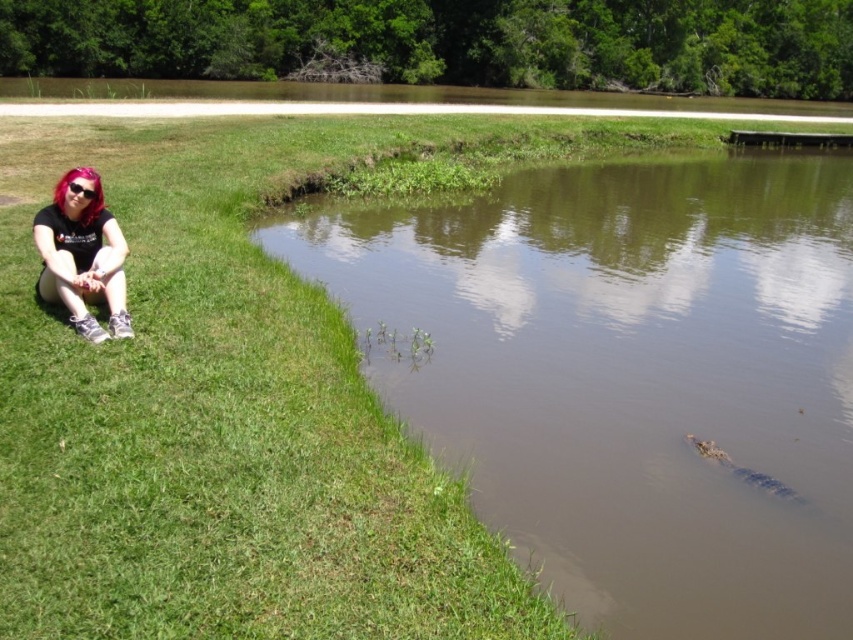
Who is lower down, brown muddy water at lower left or sunglasses at left?

brown muddy water at lower left is below.

Is point (750, 508) closer to viewer compared to point (91, 195)?

Yes, it is in front of point (91, 195).

Who is more forward, (660, 465) or (91, 193)?

Point (91, 193)

This screenshot has height=640, width=853. What are the coordinates of `brown muddy water at lower left` in the screenshot? It's located at (630, 376).

Who is more forward, (850,440) or (67,268)?

Point (67,268)

Where is `brown muddy water at lower left`? This screenshot has height=640, width=853. brown muddy water at lower left is located at coordinates [x=630, y=376].

Who is higher up, matte black hair at lower left or sunglasses at left?

sunglasses at left is higher up.

Who is more distant from viewer, (99, 276) or (73, 192)?

Positioned behind is point (73, 192).

Where is `matte black hair at lower left`? matte black hair at lower left is located at coordinates (82, 257).